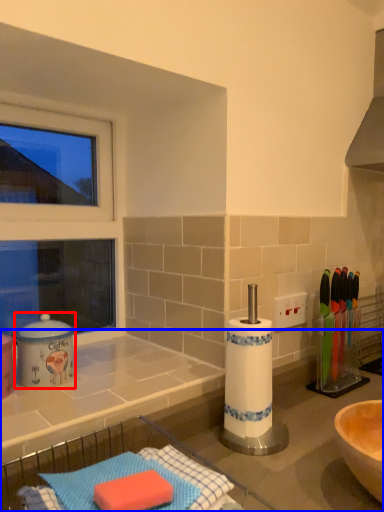
Question: Among these objects, which one is farthest to the camera, appliance (highlighted by a red box) or countertop (highlighted by a blue box)?

Choices:
 (A) appliance
 (B) countertop

Answer: (A)